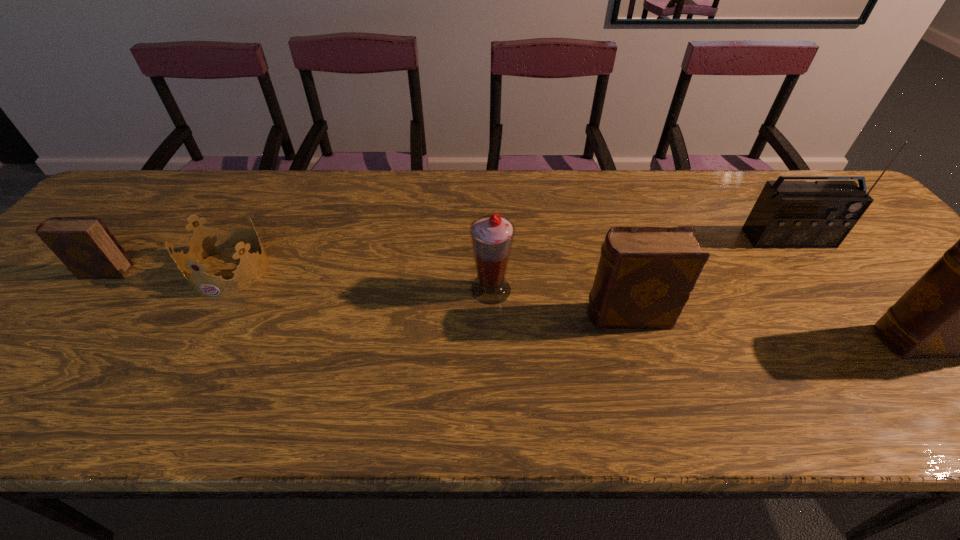
Where is `free space located 0.280m on the spine side of the second tallest diary`? This screenshot has height=540, width=960. free space located 0.280m on the spine side of the second tallest diary is located at coordinates (460, 316).

In order to click on free region located 0.120m on the spine side of the second tallest diary in this screenshot , I will do `click(532, 316)`.

Identify the location of free space located 0.270m on the spine side of the second tallest diary. (465, 316).

The image size is (960, 540). I want to click on free space located 0.220m on the front panel of the radio receiver, so click(x=846, y=316).

I want to click on free region located on the right of the smoothie, so click(x=667, y=289).

Find the location of `blank area located on the front-facing side of the tiara`. blank area located on the front-facing side of the tiara is located at coordinates (200, 324).

Where is `object that is at the left edge`? The image size is (960, 540). object that is at the left edge is located at coordinates (87, 248).

Locate an element on the screen. object situated at the right edge is located at coordinates (787, 214).

I want to click on vacant space at the far edge of the desktop, so click(511, 215).

Locate an element on the screen. This screenshot has width=960, height=540. vacant space at the near edge of the desktop is located at coordinates (754, 355).